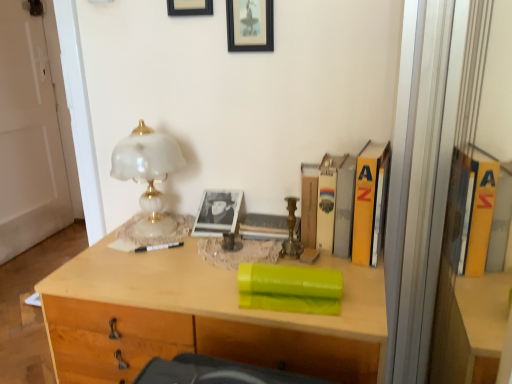
The image size is (512, 384). Identify the location of black matte picture frame at upper center, placed as the second picture frame when sorted from right to left. (189, 7).

Image resolution: width=512 pixels, height=384 pixels. What do you see at coordinates (365, 200) in the screenshot? I see `yellow matte book at right` at bounding box center [365, 200].

You are a GUI agent. You are given a task and a screenshot of the screen. Output one action in this format:
    pyautogui.click(x=<x>, y=<y>)
    Task: Click on the green matte book at center, the second book when ordered from back to front
    The image size is (512, 384).
    Given the screenshot: What is the action you would take?
    pyautogui.click(x=290, y=281)

Which is in front, black matte picture frame at upper center, which is the first picture frame from left to right, or light wood desk at center?

light wood desk at center is closer to the camera.

From the image's perspective, is black matte picture frame at upper center, which is the first picture frame from left to right, located above or below light wood desk at center?

black matte picture frame at upper center, which is the first picture frame from left to right, is above light wood desk at center.

Is point (190, 11) more distant than point (63, 318)?

That is True.

Is black matte picture frame at upper center, placed as the second picture frame when sorted from right to left, outside of light wood desk at center?

Yes, black matte picture frame at upper center, placed as the second picture frame when sorted from right to left, is located beyond the bounds of light wood desk at center.

Between black plastic pen at center and white glass lamp at upper left, which one is positioned in front?

white glass lamp at upper left is in front.

From a real-world perspective, is black plastic pen at center positioned under white glass lamp at upper left based on gravity?

Yes, from a real-world perspective, black plastic pen at center is below white glass lamp at upper left.

Measure the distance between black plastic pen at center and white glass lamp at upper left.

8.21 inches.

Which of these two, black plastic pen at center or white glass lamp at upper left, stands taller?

white glass lamp at upper left.

Considering the relative sizes of hardcover book at upper right, the second book ordered from the bottom, and black plastic pen at center in the image provided, is hardcover book at upper right, the second book ordered from the bottom, wider than black plastic pen at center?

Yes, hardcover book at upper right, the second book ordered from the bottom, is wider than black plastic pen at center.

Is hardcover book at upper right, the first book in the back-to-front sequence, smaller than black plastic pen at center?

No, hardcover book at upper right, the first book in the back-to-front sequence, is not smaller than black plastic pen at center.

In terms of height, does hardcover book at upper right, arranged as the 1th book when viewed from the top, look taller or shorter compared to black plastic pen at center?

Considering their sizes, hardcover book at upper right, arranged as the 1th book when viewed from the top, has more height than black plastic pen at center.

Is black plastic pen at center completely or partially inside hardcover book at upper right, arranged as the 1th book when viewed from the top?

Actually, black plastic pen at center is outside hardcover book at upper right, arranged as the 1th book when viewed from the top.

Considering the relative sizes of black framed picture at upper center, which appears as the 2th picture frame when viewed from the left, and green matte book at center, acting as the 2th book starting from the top, in the image provided, is black framed picture at upper center, which appears as the 2th picture frame when viewed from the left, taller than green matte book at center, acting as the 2th book starting from the top,?

Yes.

Does black framed picture at upper center, which appears as the 2th picture frame when viewed from the left, touch green matte book at center, the 2th book positioned from the right?

No, black framed picture at upper center, which appears as the 2th picture frame when viewed from the left, is not making contact with green matte book at center, the 2th book positioned from the right.

Which object is wider, black framed picture at upper center, which is counted as the first picture frame, starting from the right, or green matte book at center, which is the 1th book from front to back?

Wider between the two is green matte book at center, which is the 1th book from front to back.

Is black framed picture at upper center, which is counted as the first picture frame, starting from the right, outside of green matte book at center, which ranks as the 1th book in left-to-right order?

black framed picture at upper center, which is counted as the first picture frame, starting from the right, is positioned outside green matte book at center, which ranks as the 1th book in left-to-right order.

From the image's perspective, which is below, yellow matte book at right or black framed picture at upper center, which is counted as the first picture frame, starting from the right?

yellow matte book at right appears lower in the image.

Is yellow matte book at right not within black framed picture at upper center, which is counted as the first picture frame, starting from the right?

Yes, yellow matte book at right is located beyond the bounds of black framed picture at upper center, which is counted as the first picture frame, starting from the right.

Which object is wider, yellow matte book at right or black framed picture at upper center, which is counted as the first picture frame, starting from the right?

With larger width is yellow matte book at right.

Is yellow matte book at right looking in the opposite direction of black framed picture at upper center, which is counted as the first picture frame, starting from the right?

That's not correct — yellow matte book at right is not looking away from black framed picture at upper center, which is counted as the first picture frame, starting from the right.

Is there a large distance between hardcover book at upper right, which appears as the 2th book when viewed from the left, and yellow matte book at right?

No, hardcover book at upper right, which appears as the 2th book when viewed from the left, is not far from yellow matte book at right.

In order to click on paperback book that appears above the hardcover book at upper right, the first book in the back-to-front sequence (from a real-world perspective) in this screenshot , I will do `click(365, 200)`.

Looking at the image, does hardcover book at upper right, which appears as the 2th book when viewed from the left, seem bigger or smaller compared to yellow matte book at right?

hardcover book at upper right, which appears as the 2th book when viewed from the left, is smaller than yellow matte book at right.

Considering the points (375, 215) and (369, 208), which point is behind, point (375, 215) or point (369, 208)?

The point (375, 215) is farther.

Based on the photo, visually, is green matte book at center, which ranks as the 1th book in left-to-right order, positioned to the left or to the right of hardcover book at upper right, which appears as the 2th book when viewed from the left?

From the image, it's evident that green matte book at center, which ranks as the 1th book in left-to-right order, is to the left of hardcover book at upper right, which appears as the 2th book when viewed from the left.

From a real-world perspective, who is located lower, green matte book at center, the 2th book positioned from the right, or hardcover book at upper right, the second book viewed from the front?

In real-world perspective, green matte book at center, the 2th book positioned from the right, is lower.

What's the angular difference between green matte book at center, the second book when ordered from back to front, and hardcover book at upper right, the first book in the back-to-front sequence,'s facing directions?

15 degrees separate the facing orientations of green matte book at center, the second book when ordered from back to front, and hardcover book at upper right, the first book in the back-to-front sequence.

Would you say green matte book at center, the second book when ordered from back to front, contains hardcover book at upper right, which appears as the 2th book when viewed from the left?

No, green matte book at center, the second book when ordered from back to front, does not contain hardcover book at upper right, which appears as the 2th book when viewed from the left.

From a real-world perspective, which picture frame is the 2nd one above the light wood desk at center? Please provide its 2D coordinates.

[(189, 7)]

This screenshot has width=512, height=384. Find the location of `lamp that is in front of the black plastic pen at center`. lamp that is in front of the black plastic pen at center is located at coordinates (148, 174).

Considering their positions, is black matte picture frame at upper center, which is the first picture frame from left to right, positioned further to green matte book at center, the second book when ordered from back to front, than black framed picture at upper center, which appears as the 2th picture frame when viewed from the left?

black matte picture frame at upper center, which is the first picture frame from left to right, is positioned further to the anchor green matte book at center, the second book when ordered from back to front.

Which object lies nearer to the anchor point green matte book at center, the second book when ordered from back to front, black plastic pen at center or white glass lamp at upper left?

black plastic pen at center is positioned closer to the anchor green matte book at center, the second book when ordered from back to front.

Consider the image. Looking at the image, which one is located closer to white glossy door at left, green matte book at center, which is the 1th book from front to back, or light wood desk at center?

light wood desk at center is positioned closer to the anchor white glossy door at left.

Looking at the image, which one is located closer to light wood desk at center, hardcover book at upper right, the second book viewed from the front, or black framed picture at upper center, which appears as the 2th picture frame when viewed from the left?

The object closer to light wood desk at center is hardcover book at upper right, the second book viewed from the front.

When comparing their distances from black framed picture at upper center, which appears as the 2th picture frame when viewed from the left, does light wood desk at center or black plastic pen at center seem further?

The object further to black framed picture at upper center, which appears as the 2th picture frame when viewed from the left, is light wood desk at center.

Looking at the image, which one is located further to green matte book at center, which ranks as the 1th book in left-to-right order, black plastic pen at center or hardcover book at upper right, the first book in the back-to-front sequence?

Based on the image, black plastic pen at center appears to be further to green matte book at center, which ranks as the 1th book in left-to-right order.

Considering their positions, is black framed picture at upper center, which appears as the 2th picture frame when viewed from the left, positioned closer to light wood desk at center than black plastic pen at center?

Based on the image, black plastic pen at center appears to be nearer to light wood desk at center.

Estimate the real-world distances between objects in this image. Which object is closer to black plastic pen at center, black matte picture frame at upper center, placed as the second picture frame when sorted from right to left, or light wood desk at center?

light wood desk at center.

Identify the location of picture frame between white glossy door at left and black framed picture at upper center, which is counted as the first picture frame, starting from the right, in the horizontal direction. Image resolution: width=512 pixels, height=384 pixels. (189, 7).

Identify the location of lamp between black framed picture at upper center, which is counted as the first picture frame, starting from the right, and light wood desk at center in the up-down direction. The width and height of the screenshot is (512, 384). (148, 174).

Where is `pen that lies between white glass lamp at upper left and light wood desk at center from top to bottom`? pen that lies between white glass lamp at upper left and light wood desk at center from top to bottom is located at coordinates (159, 247).

Locate an element on the screen. The image size is (512, 384). picture frame between black matte picture frame at upper center, which is the first picture frame from left to right, and white glass lamp at upper left vertically is located at coordinates (250, 25).